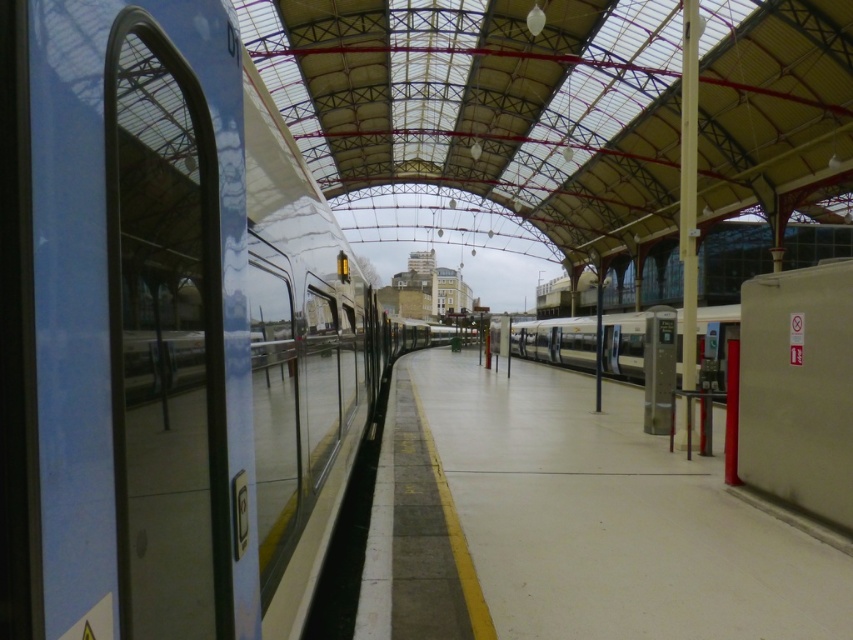
You are standing on the train station platform and want to board the polished silver train at center. According to the platform layout, where exactly is the train positioned relative to the platform?

The polished silver train at center is located at point [166,332] on the platform, so it is positioned centrally along the platform.

You are a maintenance worker on the platform. You need to check the height of the two trains, the polished silver train at center and the silver metallic train at center. Which one is shorter?

The polished silver train at center is shorter than the silver metallic train at center.